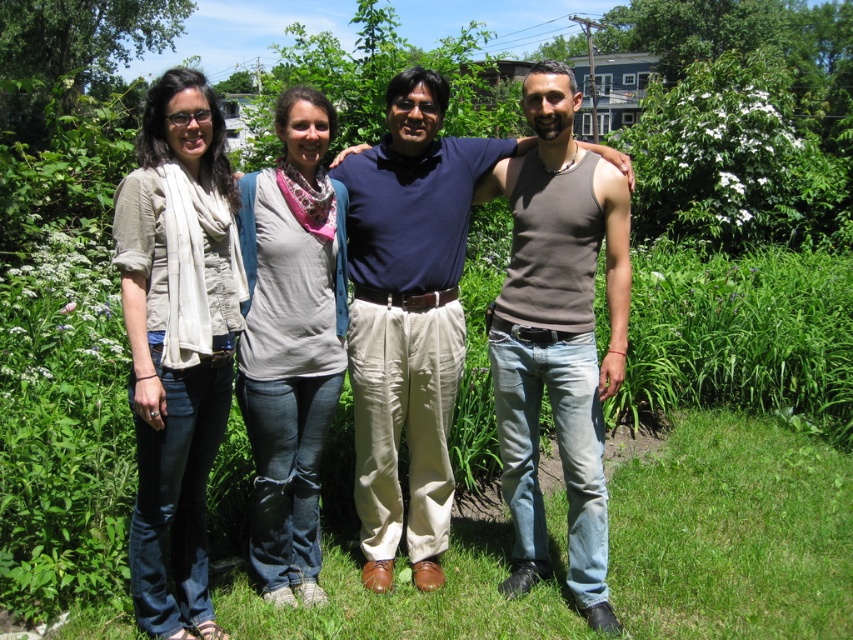
Question: Which of the following is the closest to the observer?

Choices:
 (A) (141, 128)
 (B) (838, 588)
 (C) (374, 211)

Answer: (C)

Question: Does matte beige scarf at left appear under brown cotton tank top at right?

Choices:
 (A) no
 (B) yes

Answer: (B)

Question: Among these objects, which one is nearest to the camera?

Choices:
 (A) matte beige scarf at left
 (B) brown cotton tank top at right
 (C) gray cotton shirt at center

Answer: (A)

Question: Which object appears farthest from the camera in this image?

Choices:
 (A) brown cotton tank top at right
 (B) matte beige scarf at left
 (C) brown cotton tank top at center
 (D) gray cotton shirt at center

Answer: (C)

Question: Is green grass at lower center positioned behind brown cotton tank top at right?

Choices:
 (A) yes
 (B) no

Answer: (A)

Question: From the image, what is the correct spatial relationship of brown cotton tank top at right in relation to gray cotton shirt at center?

Choices:
 (A) left
 (B) right

Answer: (B)